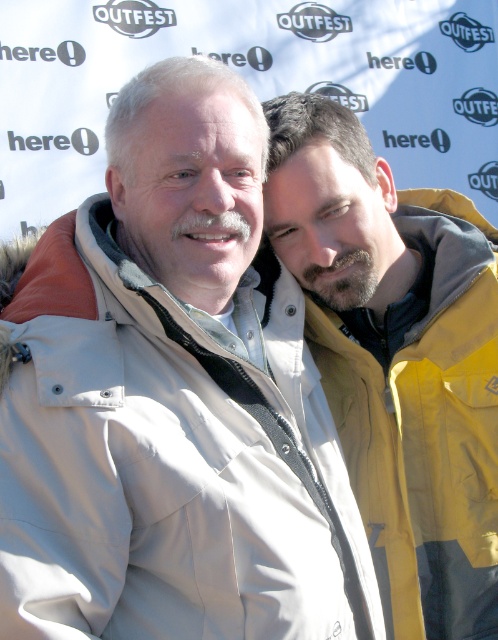
Is beige fabric jacket at center above yellow fabric jacket at right?

No, beige fabric jacket at center is not above yellow fabric jacket at right.

Is point (65, 451) positioned before point (307, 298)?

Yes, it is in front of point (307, 298).

Between point (296, 477) and point (382, 538), which one is positioned in front?

Positioned in front is point (296, 477).

Identify the location of beige fabric jacket at center. This screenshot has height=640, width=498. (169, 458).